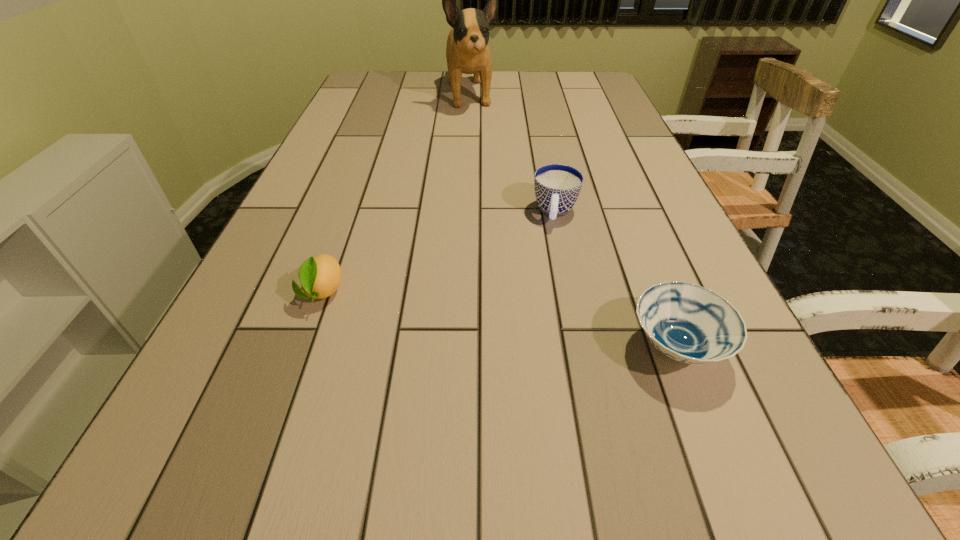
In the image, there is a desktop. At what (x,y) coordinates should I click in order to perform the action: click on vacant area at the far left corner. Please return your answer as a coordinate pair (x, y). Looking at the image, I should click on (377, 82).

Identify the location of vacant point at the near left corner. (199, 432).

Find the location of a particular element. This screenshot has width=960, height=540. vacant space at the far right corner of the desktop is located at coordinates (569, 76).

This screenshot has height=540, width=960. Find the location of `free spot between the lemon and the rightmost object`. free spot between the lemon and the rightmost object is located at coordinates (499, 319).

This screenshot has height=540, width=960. What are the coordinates of `vacant space that is in between the leftmost object and the soup bowl` in the screenshot? It's located at (499, 319).

What are the coordinates of `vacant space that is in between the puppy and the lemon` in the screenshot? It's located at (396, 193).

The height and width of the screenshot is (540, 960). What are the coordinates of `free space between the farthest object and the leftmost object` in the screenshot? It's located at (396, 193).

You are a GUI agent. You are given a task and a screenshot of the screen. Output one action in this format:
    pyautogui.click(x=<x>, y=<y>)
    Task: Click on the free spot between the third nearest object and the soup bowl
    The image size is (960, 540).
    Given the screenshot: What is the action you would take?
    615,280

You are a GUI agent. You are given a task and a screenshot of the screen. Output one action in this format:
    pyautogui.click(x=<x>, y=<y>)
    Task: Click on the vacant space that's between the second farthest object and the rightmost object
    This screenshot has width=960, height=540.
    Given the screenshot: What is the action you would take?
    pyautogui.click(x=615, y=280)

In order to click on empty location between the rightmost object and the third object from right to left in this screenshot , I will do `click(573, 221)`.